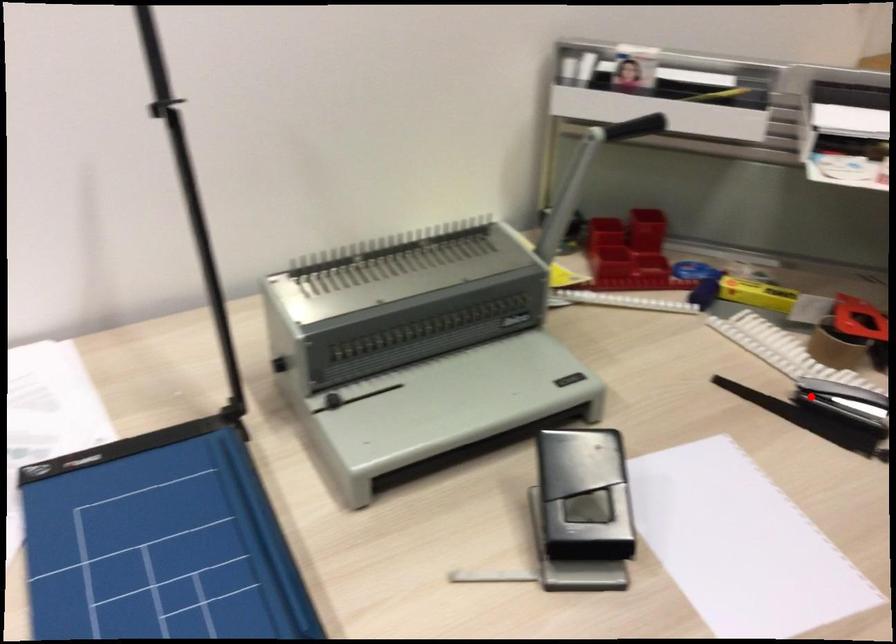
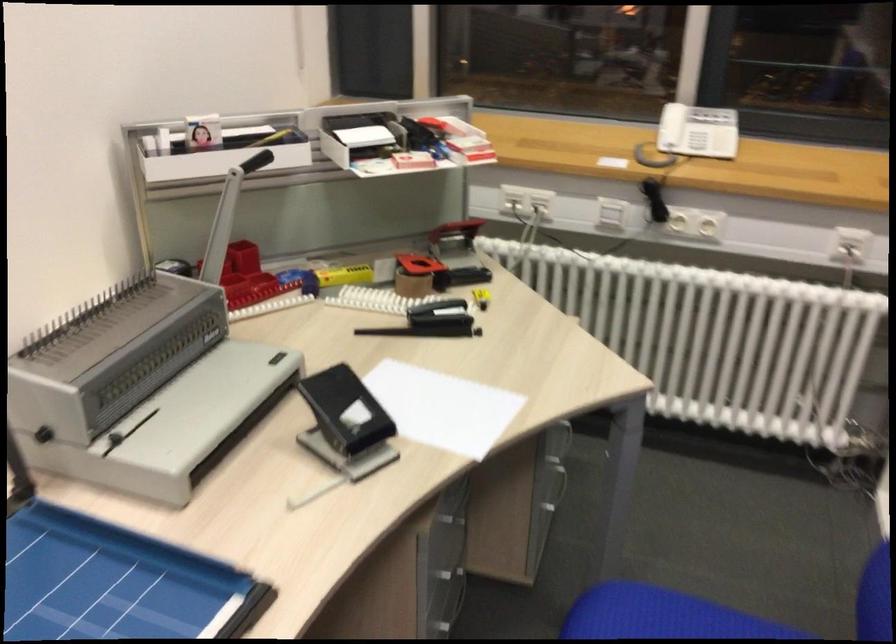
Question: I am providing you with two images of the same scene from different viewpoints. Image1 has a red point marked. In image2, the corresponding 3D location appears at what relative position? Reply with the corresponding letter.

Choices:
 (A) Closer
 (B) Farther

Answer: (B)